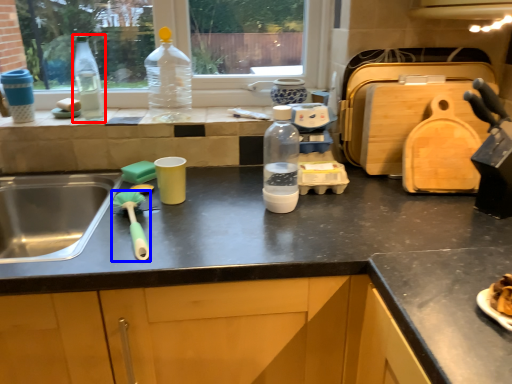
Question: Which point is closer to the camera, bottle (highlighted by a red box) or brush (highlighted by a blue box)?

Choices:
 (A) bottle
 (B) brush

Answer: (B)